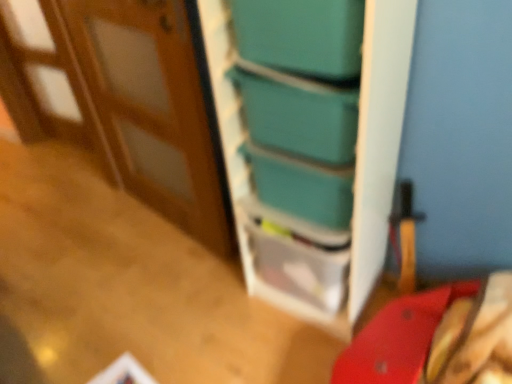
Question: Should I look upward or downward to see smooth red table at lower right?

Choices:
 (A) up
 (B) down

Answer: (B)

Question: Is teal plastic box at upper center, which is the 1th box in top-to-bottom order, facing away from teal plastic bookshelf at center?

Choices:
 (A) yes
 (B) no

Answer: (A)

Question: Is teal plastic box at upper center, the second box from the bottom, at the left side of teal plastic bookshelf at center?

Choices:
 (A) yes
 (B) no

Answer: (A)

Question: Is teal plastic box at upper center, the second box from the bottom, positioned beyond the bounds of teal plastic bookshelf at center?

Choices:
 (A) yes
 (B) no

Answer: (B)

Question: From the image's perspective, does teal plastic box at upper center, the second box from the bottom, appear lower than teal plastic bookshelf at center?

Choices:
 (A) yes
 (B) no

Answer: (B)

Question: Does teal plastic box at upper center, which is the 1th box in top-to-bottom order, have a greater height compared to teal plastic bookshelf at center?

Choices:
 (A) yes
 (B) no

Answer: (B)

Question: Does teal plastic box at upper center, the second box from the bottom, have a larger size compared to teal plastic bookshelf at center?

Choices:
 (A) yes
 (B) no

Answer: (B)

Question: Is wooden at left located within teal plastic bookshelf at center?

Choices:
 (A) yes
 (B) no

Answer: (B)

Question: Is teal plastic bookshelf at center not near wooden at left?

Choices:
 (A) yes
 (B) no

Answer: (B)

Question: Is teal plastic bookshelf at center positioned before wooden at left?

Choices:
 (A) no
 (B) yes

Answer: (B)

Question: From a real-world perspective, is teal plastic bookshelf at center physically above wooden at left?

Choices:
 (A) yes
 (B) no

Answer: (B)

Question: From the image's perspective, is teal plastic bookshelf at center under wooden at left?

Choices:
 (A) yes
 (B) no

Answer: (A)

Question: Does teal plastic bookshelf at center touch wooden at left?

Choices:
 (A) yes
 (B) no

Answer: (B)

Question: Is teal plastic bookshelf at center facing away from teal plastic box at upper center, which is the 1th box in top-to-bottom order?

Choices:
 (A) no
 (B) yes

Answer: (A)